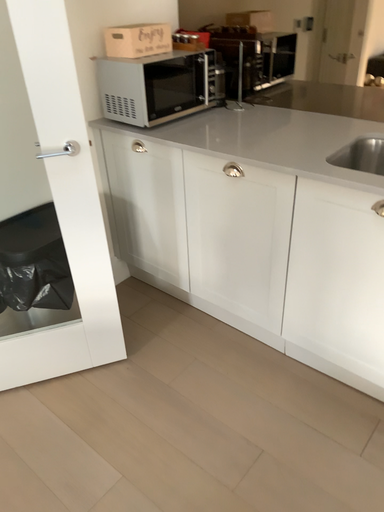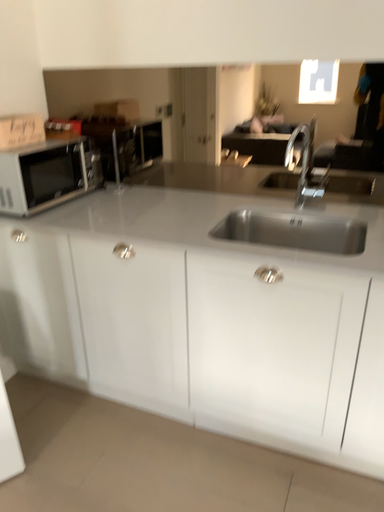
Question: How did the camera likely rotate when shooting the video?

Choices:
 (A) rotated left
 (B) rotated right

Answer: (B)